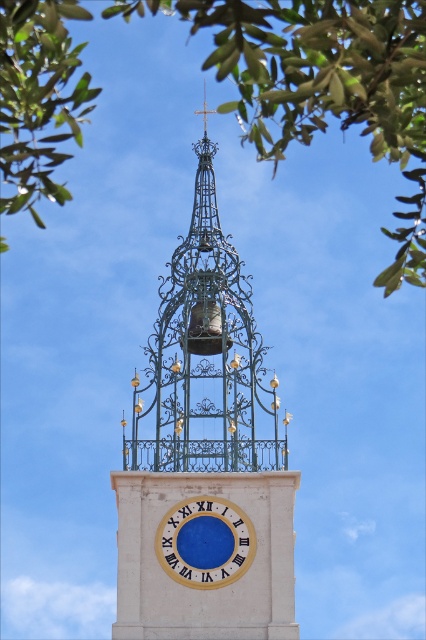
Question: Which object is positioned closest to the metallic wirework clock tower at center?

Choices:
 (A) blue wooden clock at center
 (B) green leafy tree at upper center

Answer: (A)

Question: Is green leafy tree at upper center positioned before green leafy tree at upper left?

Choices:
 (A) no
 (B) yes

Answer: (B)

Question: Considering the relative positions of metallic wirework clock tower at center and blue wooden clock at center in the image provided, where is metallic wirework clock tower at center located with respect to blue wooden clock at center?

Choices:
 (A) below
 (B) above

Answer: (B)

Question: Which point appears closest to the camera in this image?

Choices:
 (A) (75, 1)
 (B) (232, 68)
 (C) (245, 541)

Answer: (B)

Question: Which object is closer to the camera taking this photo?

Choices:
 (A) metallic wirework clock tower at center
 (B) green leafy tree at upper center

Answer: (B)

Question: In this image, where is green leafy tree at upper left located relative to blue wooden clock at center?

Choices:
 (A) right
 (B) left

Answer: (B)